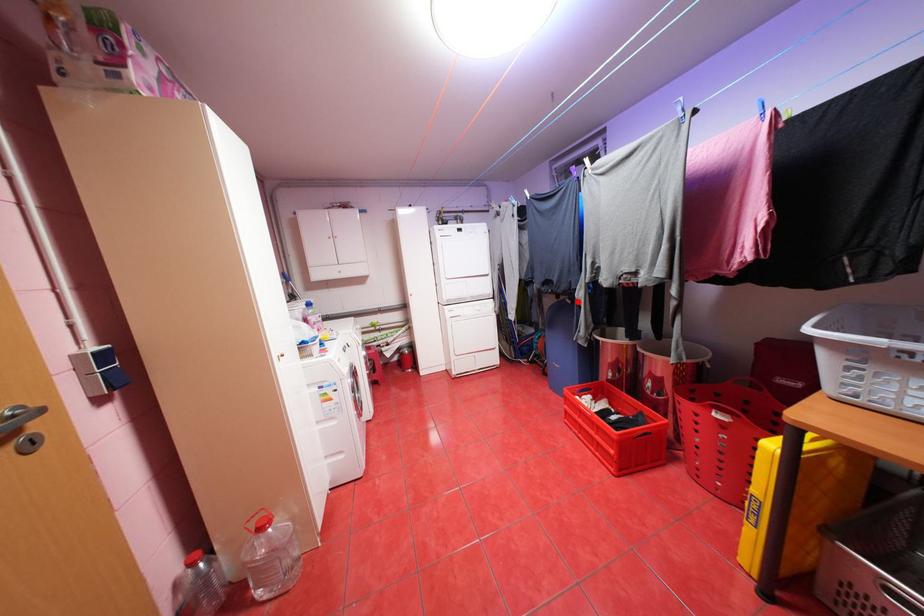
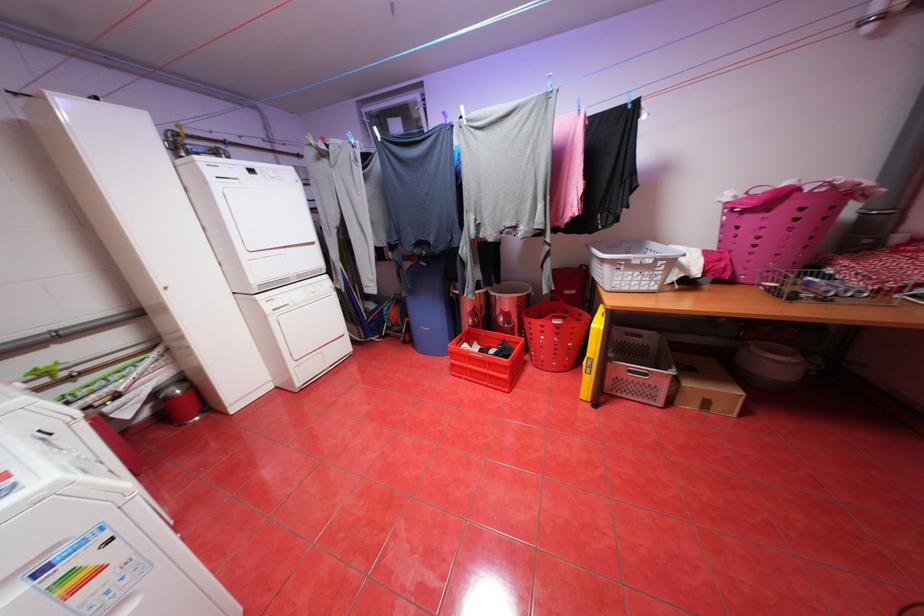
Question: I am providing you with two images of the same scene from different viewpoints. In image1, a red point is highlighted. Considering the same 3D point in image2, which of the following is correct?

Choices:
 (A) It is closer
 (B) It is farther

Answer: (B)